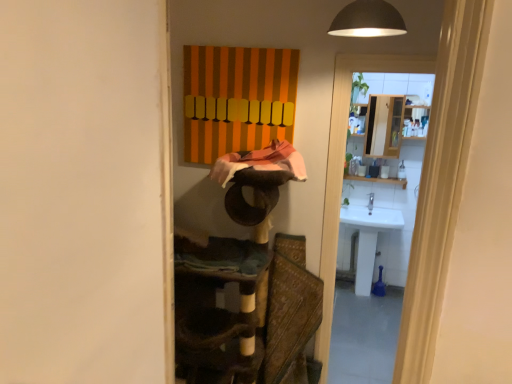
Question: Does white glossy sink at right have a lesser height compared to white glossy sink at right?

Choices:
 (A) no
 (B) yes

Answer: (A)

Question: Could you tell me if white glossy sink at right is turned towards white glossy sink at right?

Choices:
 (A) yes
 (B) no

Answer: (A)

Question: From a real-world perspective, is white glossy sink at right below white glossy sink at right?

Choices:
 (A) no
 (B) yes

Answer: (A)

Question: Is the position of white glossy sink at right more distant than that of white glossy sink at right?

Choices:
 (A) no
 (B) yes

Answer: (A)

Question: Is white glossy sink at right at the left side of white glossy sink at right?

Choices:
 (A) yes
 (B) no

Answer: (A)

Question: From the image's perspective, would you say white glossy sink at right is shown under white glossy sink at right?

Choices:
 (A) no
 (B) yes

Answer: (A)

Question: Could white glossy sink at right be considered to be inside textured brown fabric swivel chair at center?

Choices:
 (A) yes
 (B) no

Answer: (B)

Question: Is textured brown fabric swivel chair at center facing away from white glossy sink at right?

Choices:
 (A) no
 (B) yes

Answer: (A)

Question: Can you confirm if textured brown fabric swivel chair at center is shorter than white glossy sink at right?

Choices:
 (A) no
 (B) yes

Answer: (A)

Question: Is textured brown fabric swivel chair at center oriented towards white glossy sink at right?

Choices:
 (A) no
 (B) yes

Answer: (A)

Question: Is textured brown fabric swivel chair at center at the right side of white glossy sink at right?

Choices:
 (A) no
 (B) yes

Answer: (A)

Question: Considering the relative positions of textured brown fabric swivel chair at center and white glossy sink at right in the image provided, is textured brown fabric swivel chair at center to the left of white glossy sink at right from the viewer's perspective?

Choices:
 (A) no
 (B) yes

Answer: (B)

Question: From the image's perspective, is white glossy sink at right on top of white glossy sink at right?

Choices:
 (A) no
 (B) yes

Answer: (A)